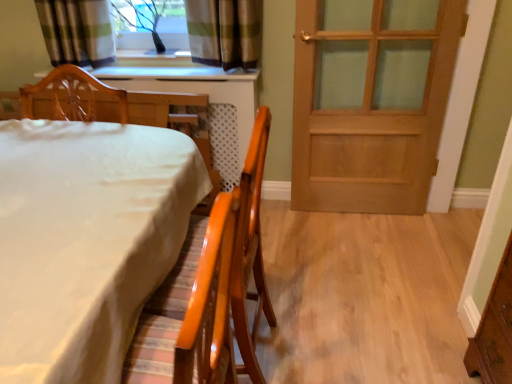
Describe the element at coordinates (210, 290) in the screenshot. I see `matte orange chair at lower left, which is the second chair from left to right` at that location.

What is the approximate height of wooden door at right?

It is 1.16 meters.

The width and height of the screenshot is (512, 384). Describe the element at coordinates (370, 102) in the screenshot. I see `wooden door at right` at that location.

You are a GUI agent. You are given a task and a screenshot of the screen. Output one action in this format:
    pyautogui.click(x=<x>, y=<y>)
    Task: Click on the clear glass window at upper center
    Image resolution: width=512 pixels, height=384 pixels.
    Given the screenshot: What is the action you would take?
    pyautogui.click(x=151, y=25)

The height and width of the screenshot is (384, 512). Identify the location of wooden chair at left, which ranks as the 2th chair in right-to-left order. (102, 101).

Can you tell me how much wooden door at right and clear glass window at upper center differ in facing direction?

The angle between the facing direction of wooden door at right and the facing direction of clear glass window at upper center is 1.05 degrees.

Considering the points (303, 103) and (179, 0), which point is behind, point (303, 103) or point (179, 0)?

The point (179, 0) is behind.

I want to click on window lying behind the wooden door at right, so click(x=151, y=25).

Considering the relative sizes of wooden chair at left, which appears as the first chair when viewed from the left, and wooden door at right in the image provided, is wooden chair at left, which appears as the first chair when viewed from the left, shorter than wooden door at right?

Indeed, wooden chair at left, which appears as the first chair when viewed from the left, has a lesser height compared to wooden door at right.

From a real-world perspective, which object rests below the other?

wooden door at right.

Does point (108, 101) lie in front of point (340, 127)?

Yes, it is.

From a real-world perspective, between wooden chair at left, which appears as the first chair when viewed from the left, and clear glass window at upper center, who is vertically lower?

In real-world perspective, wooden chair at left, which appears as the first chair when viewed from the left, is lower.

Which point is more forward, (142, 120) or (120, 25)?

The point (142, 120) is more forward.

Looking at the image, does wooden chair at left, which ranks as the 2th chair in right-to-left order, seem bigger or smaller compared to clear glass window at upper center?

wooden chair at left, which ranks as the 2th chair in right-to-left order, is bigger than clear glass window at upper center.

Does point (92, 349) appear closer or farther from the camera than point (209, 266)?

Point (92, 349) is farther from the camera than point (209, 266).

Is white glossy table at lower left beside matte orange chair at lower left, which is the second chair from left to right?

white glossy table at lower left and matte orange chair at lower left, which is the second chair from left to right, are not in contact.

Which object is thinner, white glossy table at lower left or matte orange chair at lower left, which is the second chair from left to right?

Thinner between the two is white glossy table at lower left.

Choose the correct answer: Is white glossy table at lower left inside matte orange chair at lower left, positioned as the 1th chair in right-to-left order, or outside it?

white glossy table at lower left exists outside the volume of matte orange chair at lower left, positioned as the 1th chair in right-to-left order.

Is matte orange chair at lower left, which is the second chair from left to right, further to the viewer compared to wooden chair at left, which appears as the first chair when viewed from the left?

No, matte orange chair at lower left, which is the second chair from left to right, is closer to the camera.

Consider the image. Is matte orange chair at lower left, positioned as the 1th chair in right-to-left order, thinner than wooden chair at left, which ranks as the 2th chair in right-to-left order?

In fact, matte orange chair at lower left, positioned as the 1th chair in right-to-left order, might be wider than wooden chair at left, which ranks as the 2th chair in right-to-left order.

Based on the photo, which of these two, wooden chair at left, which appears as the first chair when viewed from the left, or matte orange chair at lower left, positioned as the 1th chair in right-to-left order, is bigger?

Bigger between the two is matte orange chair at lower left, positioned as the 1th chair in right-to-left order.

Considering the sizes of wooden chair at left, which ranks as the 2th chair in right-to-left order, and matte orange chair at lower left, which is the second chair from left to right, in the image, is wooden chair at left, which ranks as the 2th chair in right-to-left order, wider or thinner than matte orange chair at lower left, which is the second chair from left to right,?

In the image, wooden chair at left, which ranks as the 2th chair in right-to-left order, appears to be more narrow than matte orange chair at lower left, which is the second chair from left to right.

Which is more to the right, wooden chair at left, which ranks as the 2th chair in right-to-left order, or matte orange chair at lower left, positioned as the 1th chair in right-to-left order?

From the viewer's perspective, matte orange chair at lower left, positioned as the 1th chair in right-to-left order, appears more on the right side.

Between clear glass window at upper center and wooden door at right, which one appears on the right side from the viewer's perspective?

wooden door at right.

I want to click on door below the clear glass window at upper center (from the image's perspective), so click(370, 102).

Considering the relative sizes of clear glass window at upper center and wooden door at right in the image provided, is clear glass window at upper center thinner than wooden door at right?

Incorrect, the width of clear glass window at upper center is not less than that of wooden door at right.

This screenshot has height=384, width=512. Identify the location of door in front of the clear glass window at upper center. (370, 102).

This screenshot has height=384, width=512. Find the location of `door behind the wooden chair at left, which ranks as the 2th chair in right-to-left order`. door behind the wooden chair at left, which ranks as the 2th chair in right-to-left order is located at coordinates (370, 102).

Considering their positions, is clear glass window at upper center positioned closer to wooden door at right than white glossy table at lower left?

clear glass window at upper center is closer to wooden door at right.

Looking at the image, which one is located further to white glossy table at lower left, matte orange chair at lower left, which is the second chair from left to right, or wooden door at right?

The object further to white glossy table at lower left is wooden door at right.

When comparing their distances from white glossy table at lower left, does clear glass window at upper center or matte orange chair at lower left, which is the second chair from left to right, seem further?

clear glass window at upper center lies further to white glossy table at lower left than the other object.

Looking at the image, which one is located further to wooden door at right, wooden chair at left, which appears as the first chair when viewed from the left, or clear glass window at upper center?

clear glass window at upper center is further to wooden door at right.

When comparing their distances from wooden door at right, does clear glass window at upper center or matte orange chair at lower left, which is the second chair from left to right, seem further?

matte orange chair at lower left, which is the second chair from left to right, is further to wooden door at right.

Based on their spatial positions, is wooden chair at left, which appears as the first chair when viewed from the left, or matte orange chair at lower left, positioned as the 1th chair in right-to-left order, closer to white glossy table at lower left?

Based on the image, matte orange chair at lower left, positioned as the 1th chair in right-to-left order, appears to be nearer to white glossy table at lower left.

Estimate the real-world distances between objects in this image. Which object is closer to clear glass window at upper center, wooden door at right or wooden chair at left, which appears as the first chair when viewed from the left?

The object closer to clear glass window at upper center is wooden chair at left, which appears as the first chair when viewed from the left.

Looking at the image, which one is located closer to clear glass window at upper center, wooden door at right or white glossy table at lower left?

wooden door at right.

I want to click on chair positioned between matte orange chair at lower left, which is the second chair from left to right, and clear glass window at upper center from near to far, so click(x=102, y=101).

Find the location of a particular element. chair between white glossy table at lower left and wooden chair at left, which ranks as the 2th chair in right-to-left order, along the z-axis is located at coordinates (210, 290).

Locate an element on the screen. window located between wooden chair at left, which appears as the first chair when viewed from the left, and wooden door at right in the left-right direction is located at coordinates (151, 25).

Locate an element on the screen. table situated between wooden chair at left, which appears as the first chair when viewed from the left, and wooden door at right from left to right is located at coordinates (86, 240).